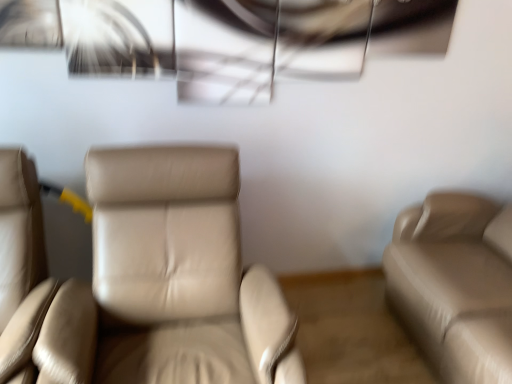
Question: Is point (154, 344) closer or farther from the camera than point (75, 377)?

Choices:
 (A) closer
 (B) farther

Answer: (B)

Question: Which is correct: beige leather chair at center, arranged as the 2th chair when viewed from the left, is inside beige leather chair at left, which is the 1th chair from left to right, or outside of it?

Choices:
 (A) outside
 (B) inside

Answer: (A)

Question: Estimate the real-world distances between objects in this image. Which object is farther from the beige leather chair at center, marked as the 1th chair in a right-to-left arrangement?

Choices:
 (A) beige leather couch at right
 (B) beige leather chair at left, which is the 1th chair from left to right

Answer: (A)

Question: Which of these objects is positioned closest to the beige leather couch at right?

Choices:
 (A) beige leather chair at center, marked as the 1th chair in a right-to-left arrangement
 (B) beige leather chair at left, which is the 1th chair from left to right

Answer: (A)